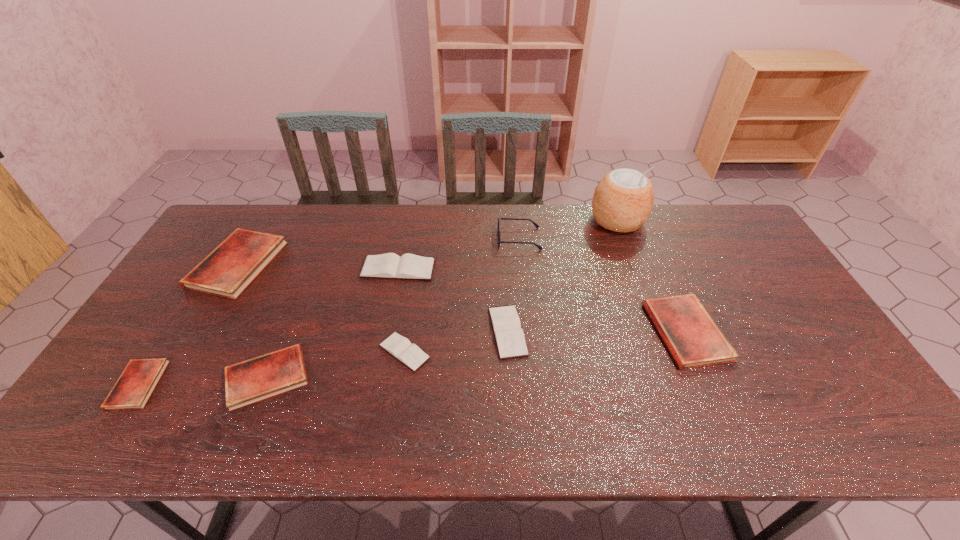
Find the location of a particular element. This screenshot has height=540, width=960. coconut is located at coordinates (622, 202).

Locate an element on the screen. This screenshot has height=540, width=960. the second tallest object is located at coordinates [498, 232].

Locate an element on the screen. The height and width of the screenshot is (540, 960). the biggest red diary is located at coordinates (230, 268).

The height and width of the screenshot is (540, 960). Find the location of `the farthest brown diary`. the farthest brown diary is located at coordinates (389, 265).

Where is `the rightmost diary`? the rightmost diary is located at coordinates (x=693, y=338).

In order to click on the rightmost red diary in this screenshot , I will do `click(693, 338)`.

The image size is (960, 540). I want to click on the second smallest brown diary, so coord(509,335).

Locate an element on the screen. the second diary from right to left is located at coordinates (509, 335).

Identify the location of the second smallest red diary. This screenshot has width=960, height=540. (253, 380).

Find the location of a particular element. the third object from left to right is located at coordinates (253, 380).